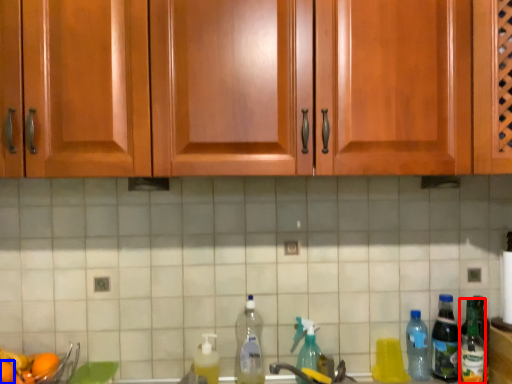
Question: Among these objects, which one is nearest to the camera, bottle (highlighted by a red box) or orange (highlighted by a blue box)?

Choices:
 (A) bottle
 (B) orange

Answer: (B)